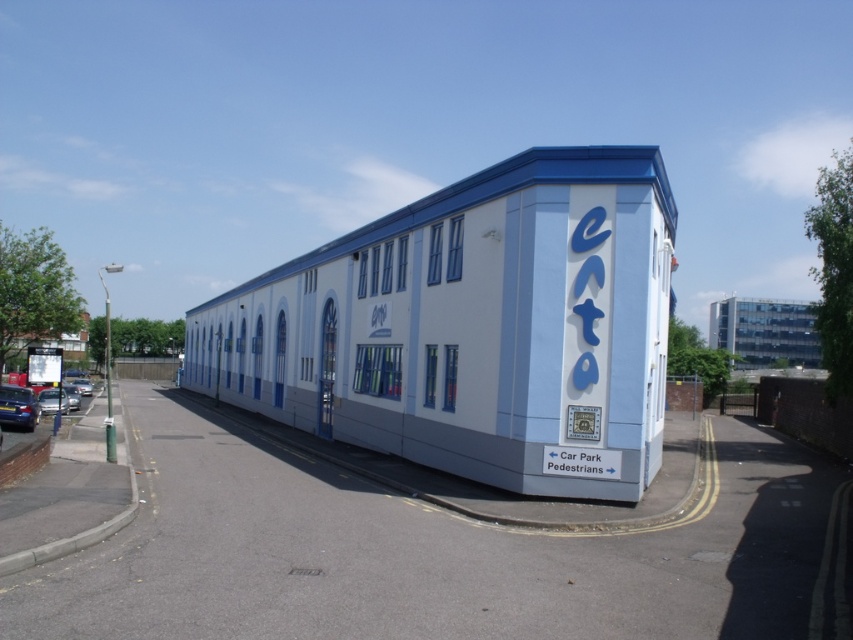
Question: Does shiny metallic car at lower left have a larger size compared to shiny silver car at lower left?

Choices:
 (A) no
 (B) yes

Answer: (A)

Question: Which of the following is the closest to the observer?

Choices:
 (A) shiny metallic car at lower left
 (B) shiny silver car at lower left
 (C) silver metallic car at left
 (D) light blue painted metal building at center

Answer: (D)

Question: Which point is closer to the camera taking this photo?

Choices:
 (A) pos(62,408)
 (B) pos(79,387)
 (C) pos(12,410)

Answer: (C)

Question: Where is light blue painted metal building at center located in relation to shiny silver car at center in the image?

Choices:
 (A) left
 (B) right

Answer: (B)

Question: Which of these objects is positioned farthest from the light blue painted metal building at center?

Choices:
 (A) shiny silver car at lower left
 (B) shiny metallic car at lower left
 (C) shiny silver car at center
 (D) silver metallic car at left

Answer: (C)

Question: Is shiny metallic car at lower left further to the viewer compared to silver metallic car at left?

Choices:
 (A) no
 (B) yes

Answer: (A)